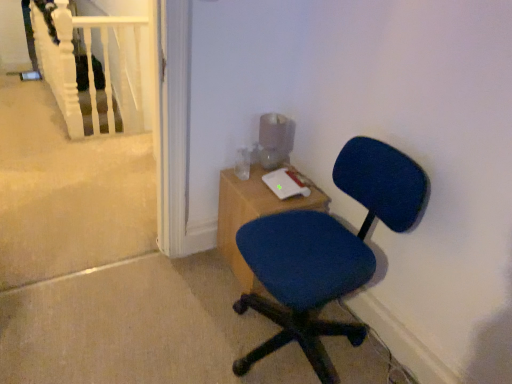
Question: Based on their positions, is white matte rail at upper left located to the left or right of wooden desk at center?

Choices:
 (A) right
 (B) left

Answer: (B)

Question: From a real-world perspective, is white matte rail at upper left physically located above or below wooden desk at center?

Choices:
 (A) above
 (B) below

Answer: (A)

Question: Which object is positioned closest to the white matte rail at upper left?

Choices:
 (A) blue fabric chair at center
 (B) wooden desk at center

Answer: (B)

Question: Which object is positioned closest to the wooden desk at center?

Choices:
 (A) blue fabric chair at center
 (B) white matte rail at upper left

Answer: (A)